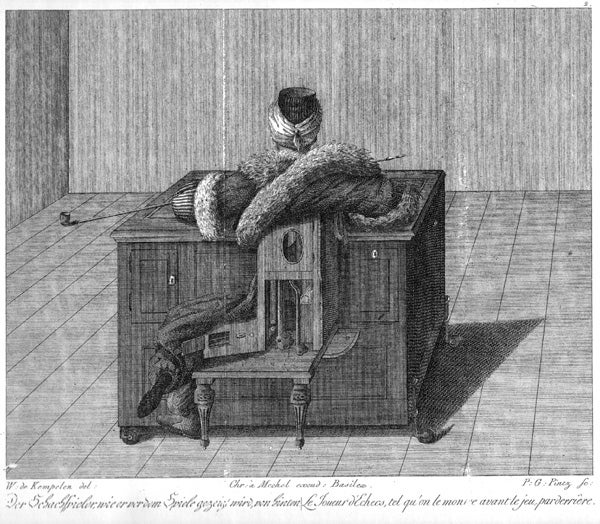
Find the location of `floor`. floor is located at coordinates (549, 450).